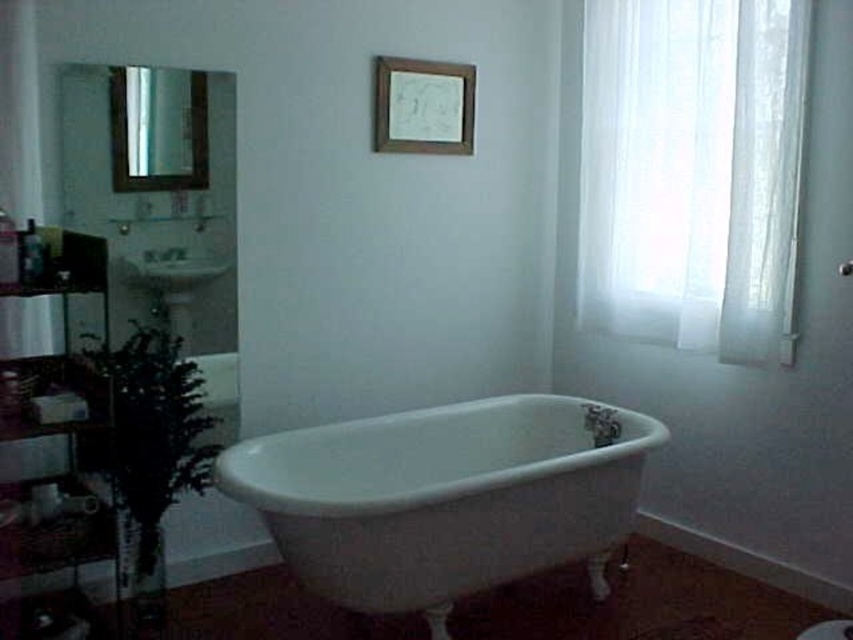
Question: Can you confirm if translucent fabric curtain at right is thinner than white glossy sink at left?

Choices:
 (A) yes
 (B) no

Answer: (B)

Question: Which of these objects is positioned closest to the wooden frame at upper center?

Choices:
 (A) white glossy sink at left
 (B) translucent fabric curtain at right

Answer: (B)

Question: Is white porcelain bathtub at center below white glossy sink at left?

Choices:
 (A) yes
 (B) no

Answer: (A)

Question: Which point is closer to the camera?

Choices:
 (A) white glossy sink at left
 (B) wooden frame at upper center
 (C) white porcelain bathtub at center

Answer: (C)

Question: Which object appears closest to the camera in this image?

Choices:
 (A) white porcelain bathtub at center
 (B) white glossy sink at left
 (C) translucent fabric curtain at right
 (D) wooden frame at upper center

Answer: (A)

Question: Can you confirm if white porcelain bathtub at center is positioned below white glossy sink at left?

Choices:
 (A) yes
 (B) no

Answer: (A)